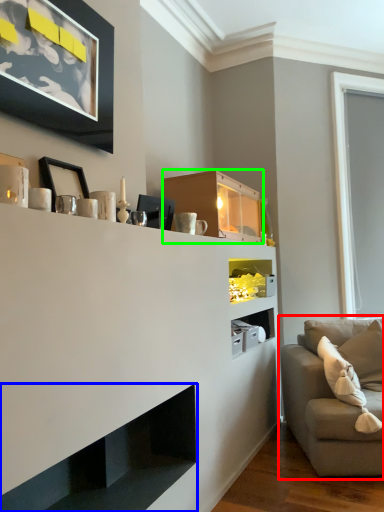
Question: Considering the real-world distances, which object is farthest from studio couch (highlighted by a red box)? shelf (highlighted by a blue box) or cabinet (highlighted by a green box)?

Choices:
 (A) shelf
 (B) cabinet

Answer: (A)